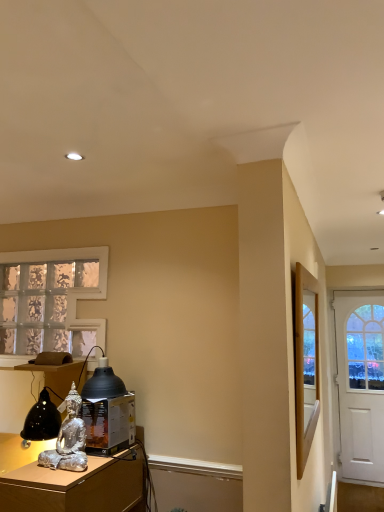
Question: Does white matte door at right have a greater height compared to silver metallic statue at lower left?

Choices:
 (A) yes
 (B) no

Answer: (A)

Question: Considering the relative sizes of white matte door at right and silver metallic statue at lower left in the image provided, is white matte door at right wider than silver metallic statue at lower left?

Choices:
 (A) no
 (B) yes

Answer: (A)

Question: Is white matte door at right next to silver metallic statue at lower left?

Choices:
 (A) yes
 (B) no

Answer: (B)

Question: Is the position of white matte door at right more distant than that of silver metallic statue at lower left?

Choices:
 (A) yes
 (B) no

Answer: (A)

Question: From the image's perspective, does white matte door at right appear higher than silver metallic statue at lower left?

Choices:
 (A) no
 (B) yes

Answer: (A)

Question: From a real-world perspective, is white matte door at right positioned under silver metallic statue at lower left based on gravity?

Choices:
 (A) yes
 (B) no

Answer: (B)

Question: Does silver metallic statue at lower left contain translucent glass window at left?

Choices:
 (A) yes
 (B) no

Answer: (B)

Question: From a real-world perspective, does silver metallic statue at lower left stand above translucent glass window at left?

Choices:
 (A) no
 (B) yes

Answer: (A)

Question: Is silver metallic statue at lower left not close to translucent glass window at left?

Choices:
 (A) no
 (B) yes

Answer: (A)

Question: From a real-world perspective, is silver metallic statue at lower left located beneath translucent glass window at left?

Choices:
 (A) yes
 (B) no

Answer: (A)

Question: From the image's perspective, would you say silver metallic statue at lower left is positioned over translucent glass window at left?

Choices:
 (A) no
 (B) yes

Answer: (A)

Question: Is silver metallic statue at lower left placed right next to translucent glass window at left?

Choices:
 (A) yes
 (B) no

Answer: (B)

Question: Is white matte door at right bigger than matte black lampshade at lower left?

Choices:
 (A) no
 (B) yes

Answer: (B)